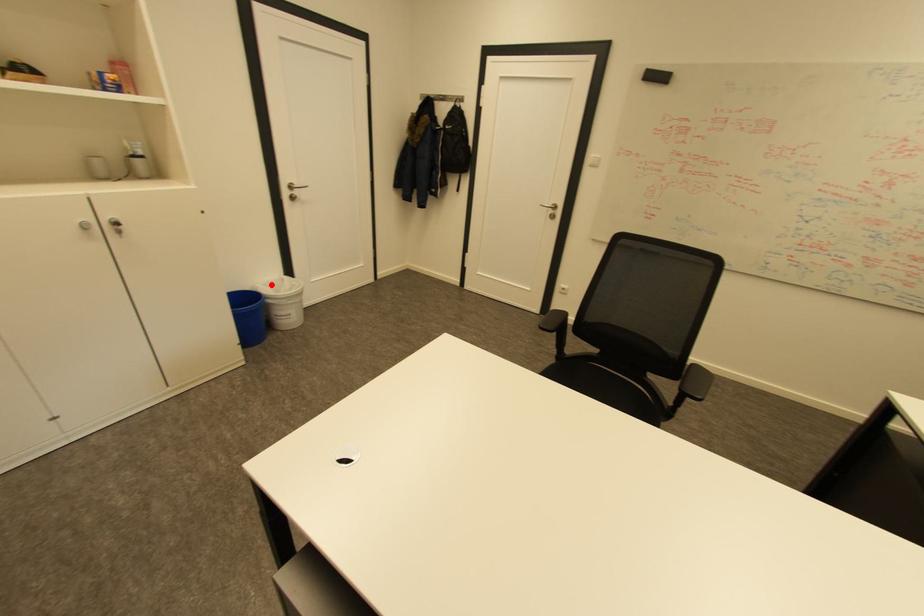
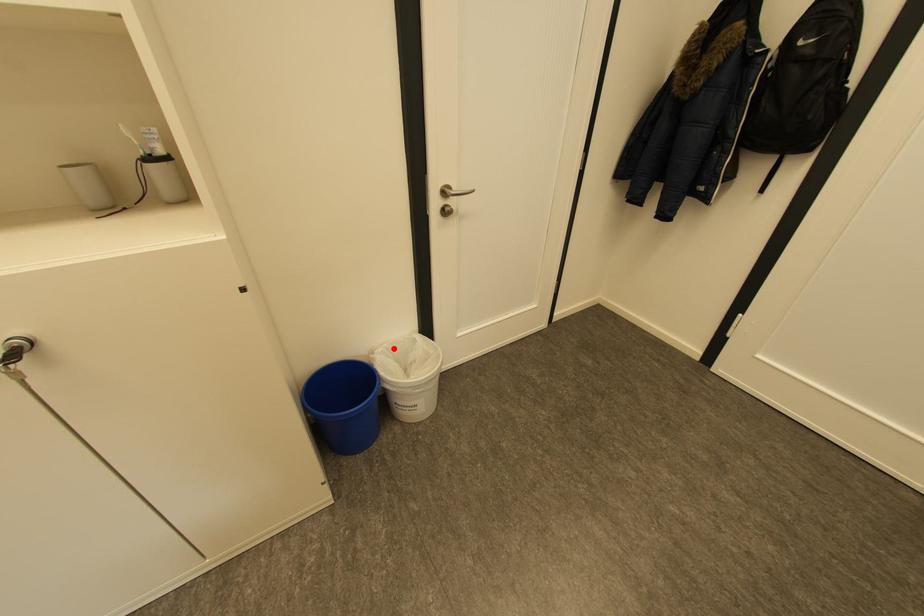
I am providing you with two images of the same scene from different viewpoints. A red point is marked on the first image and another point is marked on the second image. Does the point marked in image1 correspond to the same location as the one in image2?

Yes